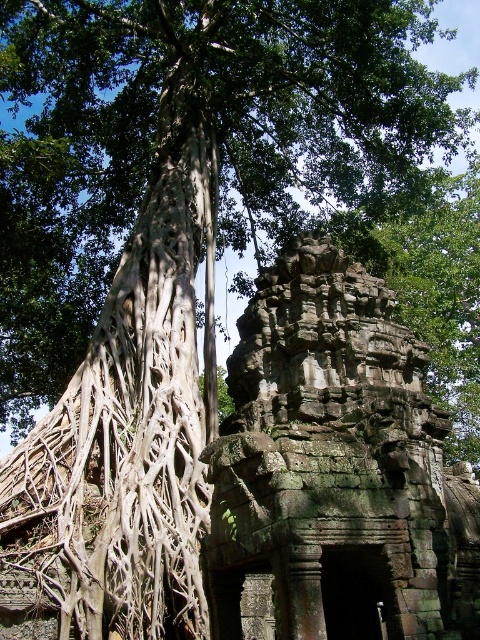
Question: Which of the following is the closest to the observer?

Choices:
 (A) (113, 396)
 (B) (404, 577)

Answer: (B)

Question: Observing the image, what is the correct spatial positioning of gray stone ruins at center in reference to white textured roots at left?

Choices:
 (A) below
 (B) above

Answer: (A)

Question: Does gray stone ruins at center come in front of white textured roots at left?

Choices:
 (A) yes
 (B) no

Answer: (A)

Question: Does gray stone ruins at center have a greater width compared to white textured roots at left?

Choices:
 (A) yes
 (B) no

Answer: (A)